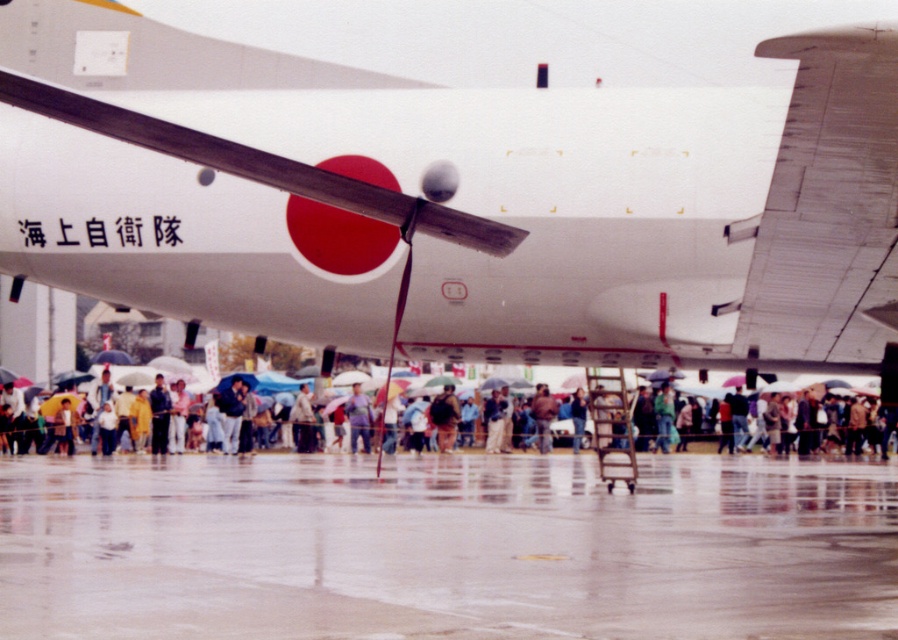
You are a photographer standing at the back of the crowd. You want to take a photo of the white matte airplane at center and the dark brown leather jacket at center without any obstruction. Since the airplane is taller than the jacket, which object should you focus on first to ensure both are in frame?

The white matte airplane at center is taller than the dark brown leather jacket at center, so you should focus on the airplane first to ensure both are in frame.

You are a photographer standing on the glossy concrete tarmac at lower center and want to take a photo of the dark brown leather jacket at center. Which object is closer to your camera lens?

The glossy concrete tarmac at lower center is closer to the viewer than the dark brown leather jacket at center, so the glossy concrete tarmac at lower center will be closer to your camera lens.

You are a photographer standing at the edge of the runway. You notice the glossy concrete tarmac at lower center and the dark brown leather jacket at center. Which object is positioned to the right side from your viewpoint?

The glossy concrete tarmac at lower center is to the right of the dark brown leather jacket at center, so the glossy concrete tarmac at lower center is positioned to the right side from your viewpoint.